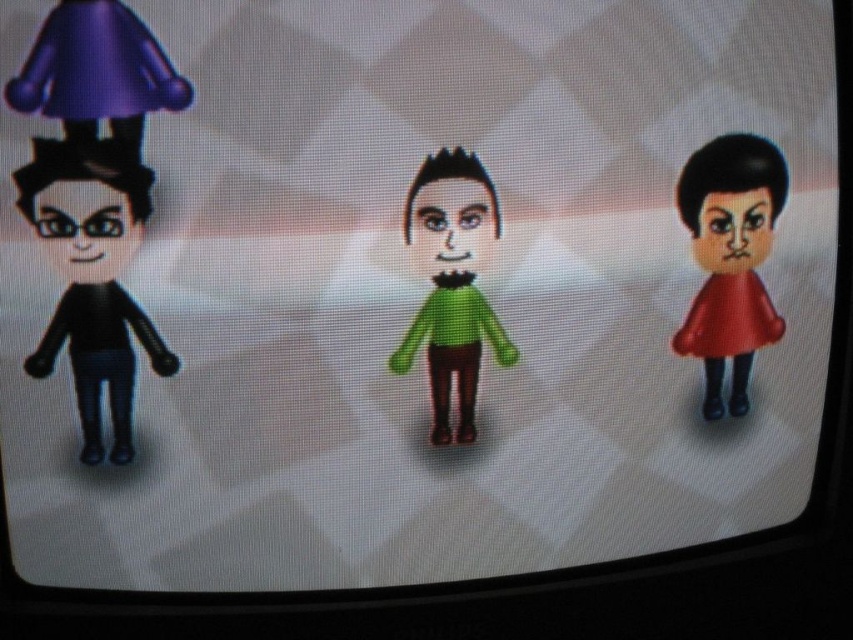
Question: Does green matte sweater at center have a greater width compared to matte black face at center right?

Choices:
 (A) yes
 (B) no

Answer: (A)

Question: Which point appears closest to the camera in this image?

Choices:
 (A) (759, 170)
 (B) (51, 232)

Answer: (B)

Question: Does purple glossy umbrella at upper left come behind matte black face at center right?

Choices:
 (A) no
 (B) yes

Answer: (A)

Question: Based on their relative distances, which object is farther from the green matte sweater at center?

Choices:
 (A) purple glossy umbrella at upper left
 (B) matte black face at left

Answer: (B)

Question: Does matte black figure at left appear over purple glossy umbrella at upper left?

Choices:
 (A) yes
 (B) no

Answer: (B)

Question: Among these points, which one is nearest to the camera?

Choices:
 (A) (123, 212)
 (B) (172, 68)
 (C) (450, 216)
 (D) (479, 340)

Answer: (B)